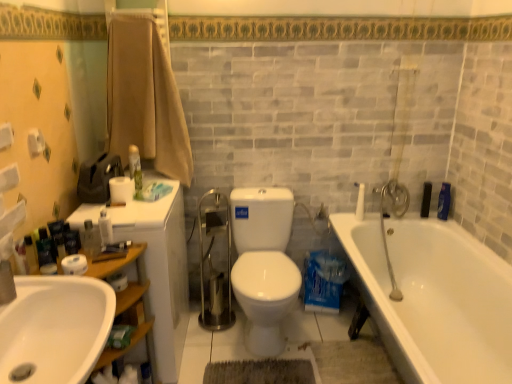
Question: Is blue plastic bottle at right, which appears as the second toiletry when viewed from the back, aimed at white glossy sink at lower left?

Choices:
 (A) yes
 (B) no

Answer: (B)

Question: From a real-world perspective, is blue plastic bottle at right, which is the 1th toiletry in right-to-left order, positioned over white glossy sink at lower left based on gravity?

Choices:
 (A) no
 (B) yes

Answer: (A)

Question: From the image's perspective, is blue plastic bottle at right, which is the 1th toiletry in right-to-left order, on top of white glossy sink at lower left?

Choices:
 (A) no
 (B) yes

Answer: (B)

Question: Is blue plastic bottle at right, which is the 1th toiletry in right-to-left order, at the left side of white glossy sink at lower left?

Choices:
 (A) yes
 (B) no

Answer: (B)

Question: Considering the relative sizes of blue plastic bottle at right, the 5th toiletry when ordered from front to back, and white glossy sink at lower left in the image provided, is blue plastic bottle at right, the 5th toiletry when ordered from front to back, taller than white glossy sink at lower left?

Choices:
 (A) yes
 (B) no

Answer: (A)

Question: Is blue plastic bottle at right, the 6th toiletry from the left, to the right of white glossy sink at lower left from the viewer's perspective?

Choices:
 (A) yes
 (B) no

Answer: (A)

Question: Is green matte spray can at upper left, which is the 3th toiletry in right-to-left order, at the left side of white ceramic faucet at upper right?

Choices:
 (A) no
 (B) yes

Answer: (B)

Question: Could white ceramic faucet at upper right be considered to be inside green matte spray can at upper left, the 4th toiletry in the left-to-right sequence?

Choices:
 (A) no
 (B) yes

Answer: (A)

Question: Is green matte spray can at upper left, placed as the third toiletry when sorted from back to front, thinner than white ceramic faucet at upper right?

Choices:
 (A) yes
 (B) no

Answer: (A)

Question: Is green matte spray can at upper left, the 4th toiletry in the left-to-right sequence, oriented away from white ceramic faucet at upper right?

Choices:
 (A) yes
 (B) no

Answer: (B)

Question: Is green matte spray can at upper left, placed as the third toiletry when sorted from back to front, positioned beyond the bounds of white ceramic faucet at upper right?

Choices:
 (A) yes
 (B) no

Answer: (A)

Question: Is the surface of green matte spray can at upper left, the 4th toiletry in the left-to-right sequence, in direct contact with white ceramic faucet at upper right?

Choices:
 (A) yes
 (B) no

Answer: (B)

Question: Is white matte toilet paper at lower left, which is counted as the 3th toilet paper, starting from the back, to the right of white glossy bathtub at lower right from the viewer's perspective?

Choices:
 (A) no
 (B) yes

Answer: (A)